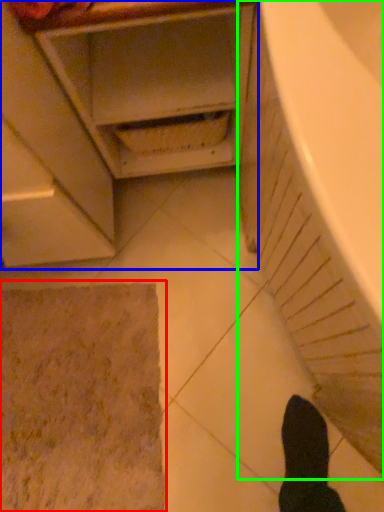
Question: Which object is the farthest from bath mat (highlighted by a red box)? Choose among these: cabinetry (highlighted by a blue box) or bath (highlighted by a green box).

Choices:
 (A) cabinetry
 (B) bath

Answer: (B)